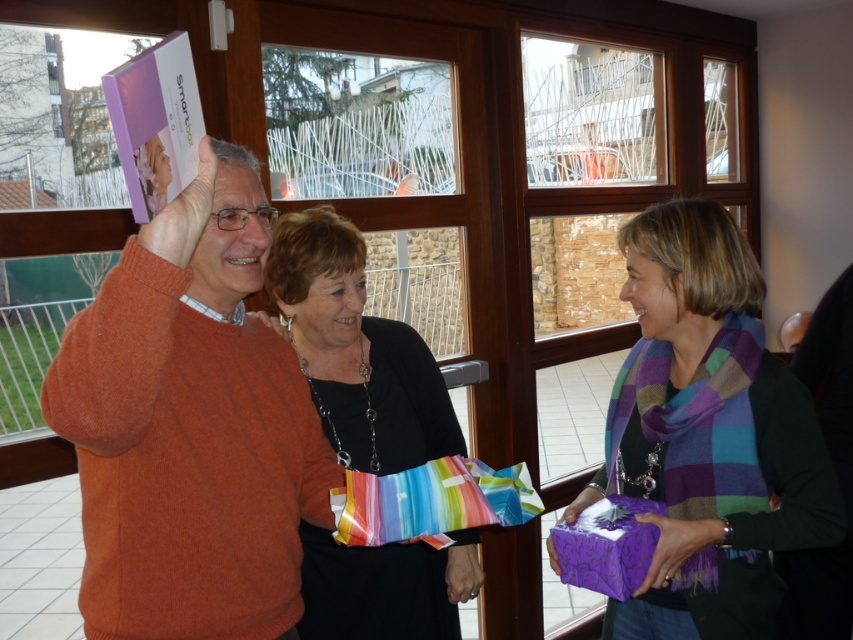
Does orange sweater at upper left appear on the left side of purple glossy gift at lower right?

Yes, orange sweater at upper left is to the left of purple glossy gift at lower right.

Based on the photo, is orange sweater at upper left positioned in front of purple glossy gift at lower right?

Yes, orange sweater at upper left is in front of purple glossy gift at lower right.

Locate an element on the screen. The image size is (853, 640). orange sweater at upper left is located at coordinates (190, 426).

I want to click on orange sweater at upper left, so 190,426.

Who is more forward, (x=184, y=509) or (x=718, y=227)?

Positioned in front is point (x=184, y=509).

Does orange sweater at upper left appear over purple matte gift at center?

Yes, orange sweater at upper left is above purple matte gift at center.

You are a GUI agent. You are given a task and a screenshot of the screen. Output one action in this format:
    pyautogui.click(x=<x>, y=<y>)
    Task: Click on the orange sweater at upper left
    This screenshot has height=640, width=853.
    Given the screenshot: What is the action you would take?
    pyautogui.click(x=190, y=426)

Identify the location of orange sweater at upper left. (190, 426).

Which is above, orange sweater at left or orange sweater at upper left?

Positioned higher is orange sweater at upper left.

Is the position of orange sweater at left less distant than that of orange sweater at upper left?

Yes, orange sweater at left is in front of orange sweater at upper left.

This screenshot has width=853, height=640. Find the location of `orange sweater at left`. orange sweater at left is located at coordinates (190, 428).